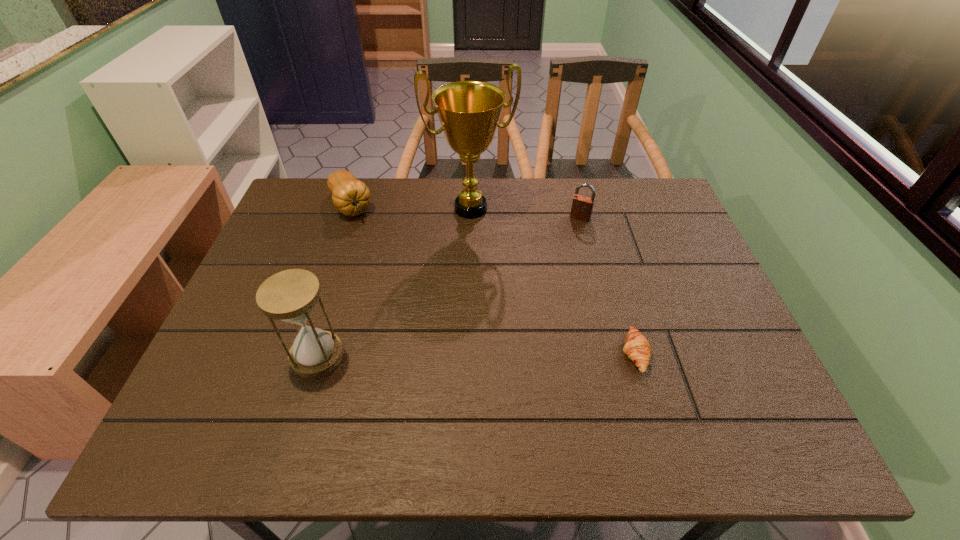
I want to click on vacant space at the far left corner, so click(315, 211).

In the image, there is a desktop. Where is `free region at the far right corner`? This screenshot has width=960, height=540. free region at the far right corner is located at coordinates (626, 193).

This screenshot has height=540, width=960. I want to click on free space at the near right corner, so click(723, 392).

The height and width of the screenshot is (540, 960). Identify the location of free area in between the gourd and the shortest object. (492, 279).

You are a GUI agent. You are given a task and a screenshot of the screen. Output one action in this format:
    pyautogui.click(x=<x>, y=<y>)
    Task: Click on the empty location between the padlock and the third object from right to left
    This screenshot has height=540, width=960.
    Given the screenshot: What is the action you would take?
    pyautogui.click(x=525, y=213)

The image size is (960, 540). Identify the location of vacant point located between the padlock and the second tallest object. (448, 287).

Find the location of a particular element. The height and width of the screenshot is (540, 960). vacant space that's between the padlock and the tallest object is located at coordinates (525, 213).

The image size is (960, 540). Find the location of `empty location between the gourd and the second tallest object`. empty location between the gourd and the second tallest object is located at coordinates (334, 280).

Where is `free area in between the award and the padlock`? free area in between the award and the padlock is located at coordinates (525, 213).

Find the location of `vacant area that lies between the award and the padlock`. vacant area that lies between the award and the padlock is located at coordinates (525, 213).